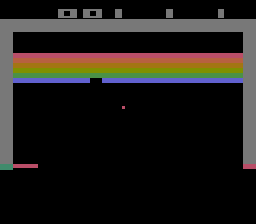
Identify the location of black screen. (129, 166), (170, 47), (153, 9).